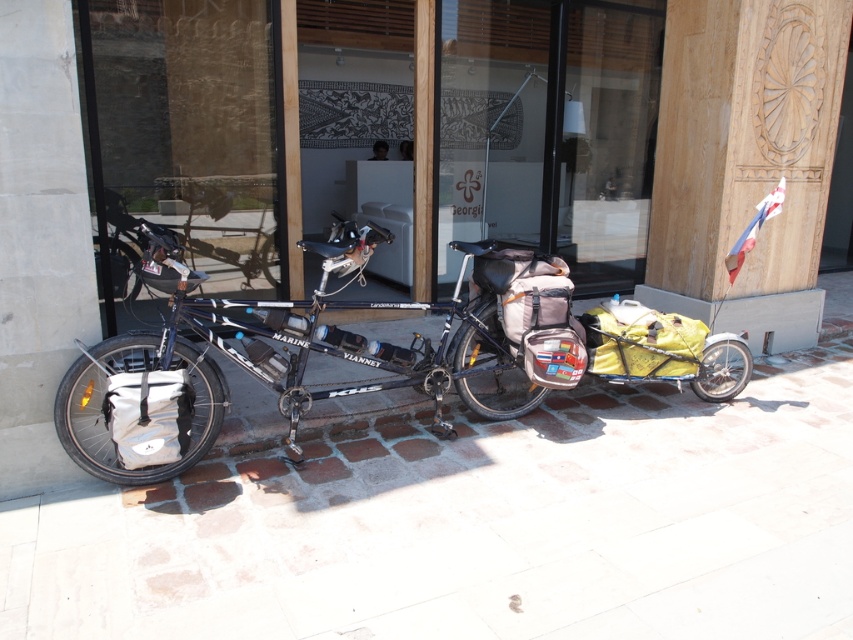
You are standing in front of the tandem bicycle and want to take a photo. You notice two points on the bicycle, one at point coordinates point (51, 589) and another at point coordinates point (0, 20). Which point will appear larger in your photo?

Point (51, 589) is closer to the camera than point 0.033, 001, so it will appear larger in the photo.